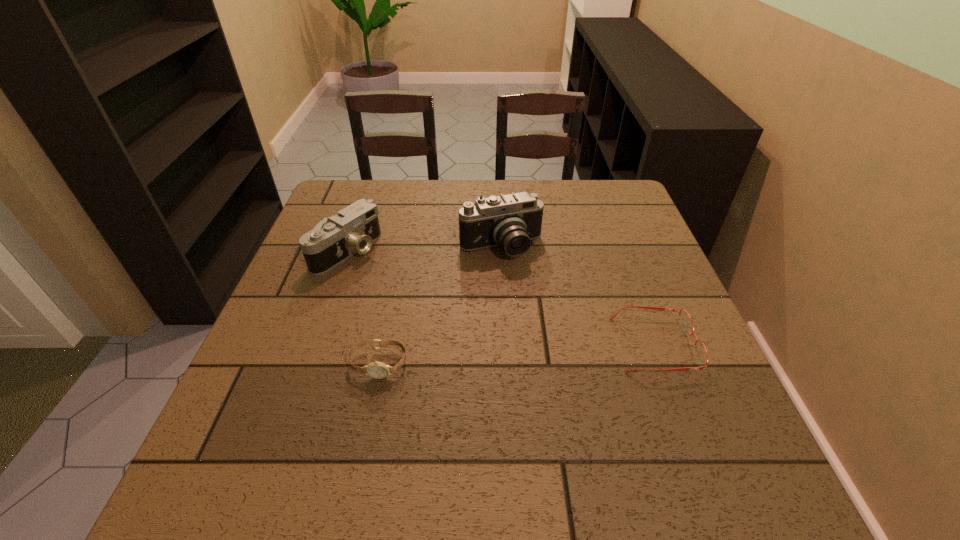
At what (x,y) coordinates should I click in order to perform the action: click on vacant area at the far right corner. Please return your answer as a coordinate pair (x, y). Looking at the image, I should click on (596, 200).

Find the location of `vacant space in between the shortest object and the second object from left to right`. vacant space in between the shortest object and the second object from left to right is located at coordinates (516, 354).

Where is `blank region between the third shortest object and the watch`? blank region between the third shortest object and the watch is located at coordinates pos(363,307).

The image size is (960, 540). I want to click on free space between the right camera and the left camera, so click(x=424, y=249).

At what (x,y) coordinates should I click in order to perform the action: click on free space between the second object from left to right and the rightmost object. Please return your answer as a coordinate pair (x, y). Image resolution: width=960 pixels, height=540 pixels. Looking at the image, I should click on (516, 354).

Image resolution: width=960 pixels, height=540 pixels. I want to click on free spot between the spectacles and the third object from right to left, so click(516, 354).

At what (x,y) coordinates should I click in order to perform the action: click on empty space between the third shortest object and the right camera. Please return your answer as a coordinate pair (x, y). The height and width of the screenshot is (540, 960). Looking at the image, I should click on (424, 249).

Locate an element on the screen. The width and height of the screenshot is (960, 540). free space between the second tallest object and the rightmost object is located at coordinates (501, 298).

Identify the location of empty space that is in between the shorter camera and the second object from left to right. (363, 307).

The image size is (960, 540). What are the coordinates of `free space between the spectacles and the tallest object` in the screenshot? It's located at click(578, 296).